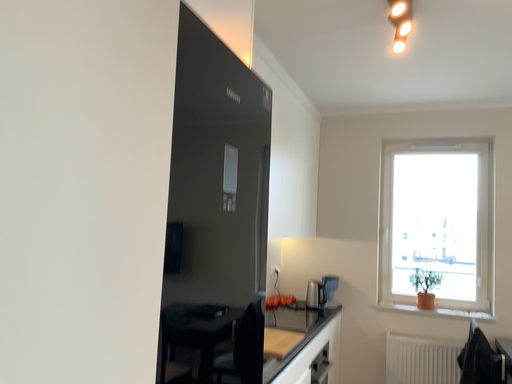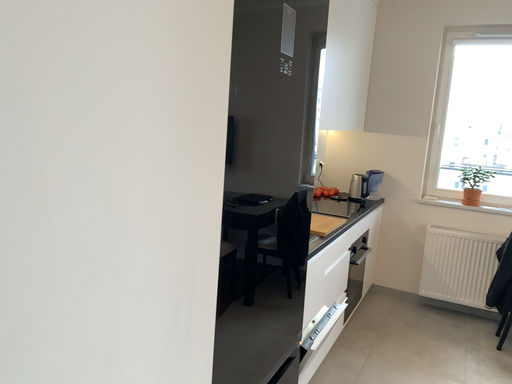
Question: Which way did the camera rotate in the video?

Choices:
 (A) rotated downward
 (B) rotated upward

Answer: (A)